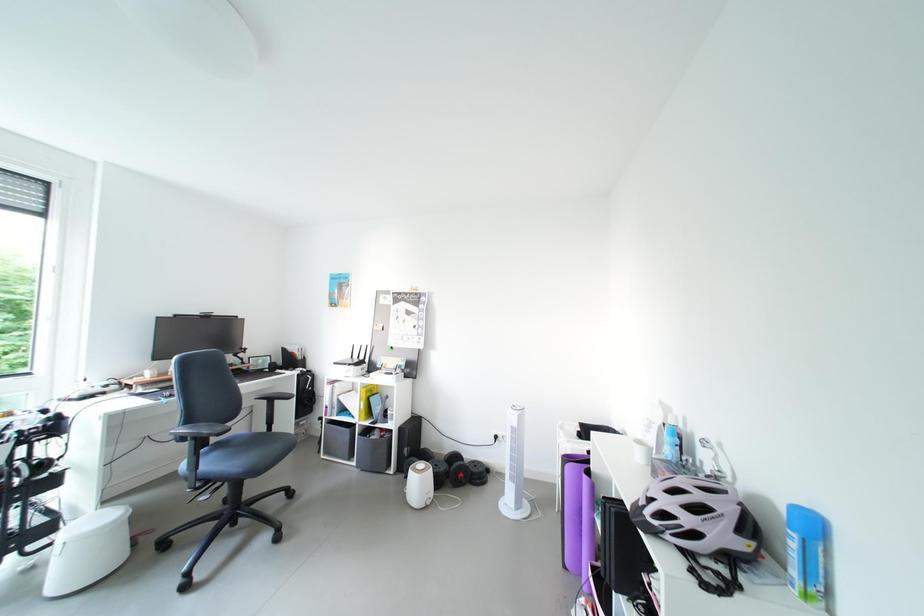
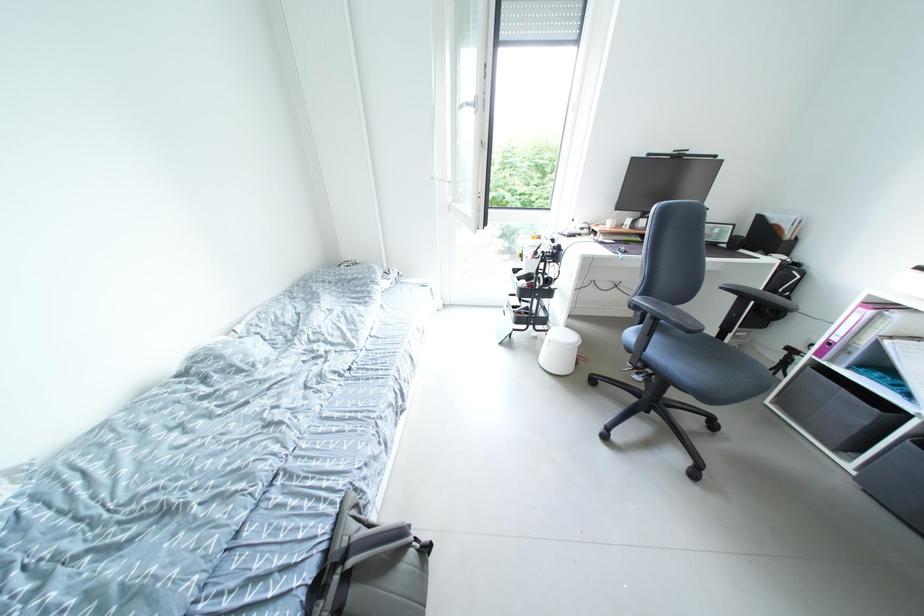
Based on the continuous images, in which direction is the camera rotating?

The camera's rotation is toward left-down.